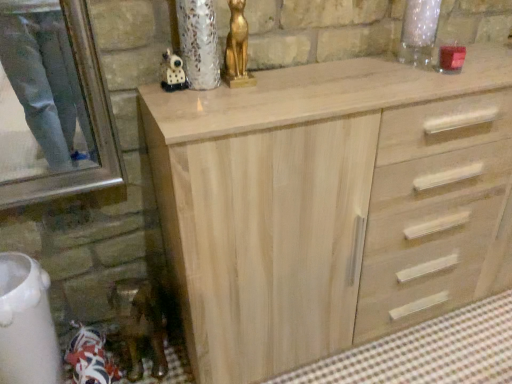
This screenshot has width=512, height=384. I want to click on vacant space to the right of matte black figurine at upper center, the 2th miniature when ordered from bottom to top, so pos(236,82).